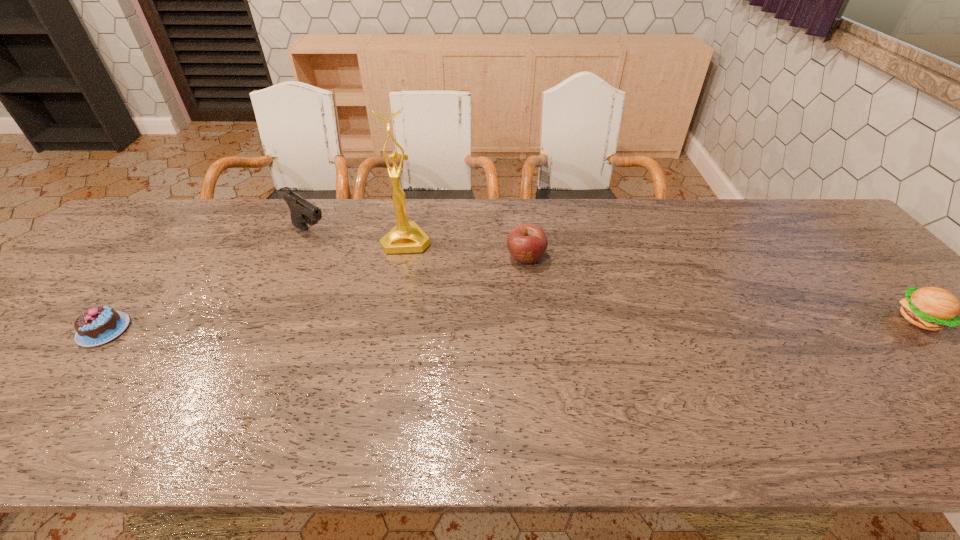
At what (x,y) coordinates should I click in order to perform the action: click on vacant space located 0.270m on the side of the second object from right to left with the unique marking. Please return your answer as a coordinate pair (x, y). Image resolution: width=960 pixels, height=540 pixels. Looking at the image, I should click on (473, 338).

Locate an element on the screen. The width and height of the screenshot is (960, 540). vacant space situated 0.280m on the front-facing side of the award is located at coordinates (408, 328).

Where is `free space located on the front-facing side of the award`? The width and height of the screenshot is (960, 540). free space located on the front-facing side of the award is located at coordinates (408, 313).

The height and width of the screenshot is (540, 960). I want to click on free space located on the front-facing side of the award, so 407,275.

Where is `free location located at the barrel of the fourth object from right to left`? Image resolution: width=960 pixels, height=540 pixels. free location located at the barrel of the fourth object from right to left is located at coordinates (334, 248).

Locate an element on the screen. This screenshot has width=960, height=540. vacant area located 0.240m at the barrel of the fourth object from right to left is located at coordinates (376, 276).

This screenshot has width=960, height=540. What are the coordinates of `vacant space located 0.110m at the barrel of the fourth object from right to left` in the screenshot? It's located at (347, 256).

The width and height of the screenshot is (960, 540). In order to click on apple that is at the far edge in this screenshot , I will do `click(527, 243)`.

Find the location of a particular element. award located in the far edge section of the desktop is located at coordinates (406, 237).

The height and width of the screenshot is (540, 960). What are the coordinates of `pistol at the far edge` in the screenshot? It's located at (302, 212).